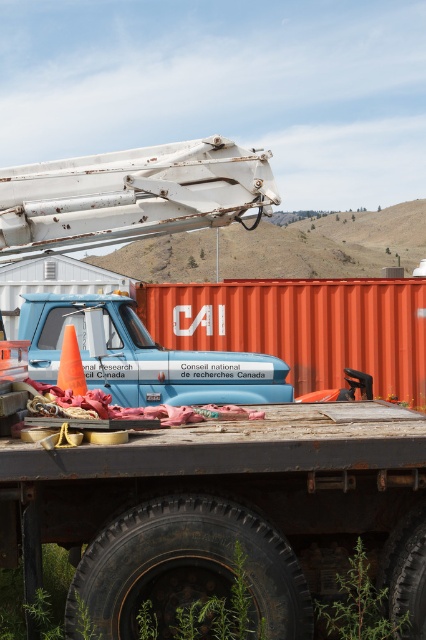
Based on the photo, is rusty metal crane arm at upper center to the left of orange matte traffic cone at lower left from the viewer's perspective?

In fact, rusty metal crane arm at upper center is to the right of orange matte traffic cone at lower left.

Between point (158, 163) and point (74, 355), which one is positioned behind?

Positioned behind is point (158, 163).

The width and height of the screenshot is (426, 640). In order to click on rusty metal crane arm at upper center in this screenshot , I will do `click(129, 195)`.

Which is more to the right, rusty metal crane arm at upper center or green leafy weed at lower center?

green leafy weed at lower center

This screenshot has width=426, height=640. Find the location of `rusty metal crane arm at upper center`. rusty metal crane arm at upper center is located at coordinates (129, 195).

Which is in front, point (224, 195) or point (331, 624)?

Positioned in front is point (331, 624).

Identify the location of rusty metal crane arm at upper center. (129, 195).

Does green leafy weed at lower center appear on the right side of orange matte traffic cone at lower left?

Indeed, green leafy weed at lower center is positioned on the right side of orange matte traffic cone at lower left.

Between point (356, 602) and point (80, 376), which one is positioned in front?

Point (356, 602)

Which is behind, point (322, 604) or point (75, 392)?

Positioned behind is point (75, 392).

What are the coordinates of `green leafy weed at lower center` in the screenshot? It's located at (359, 605).